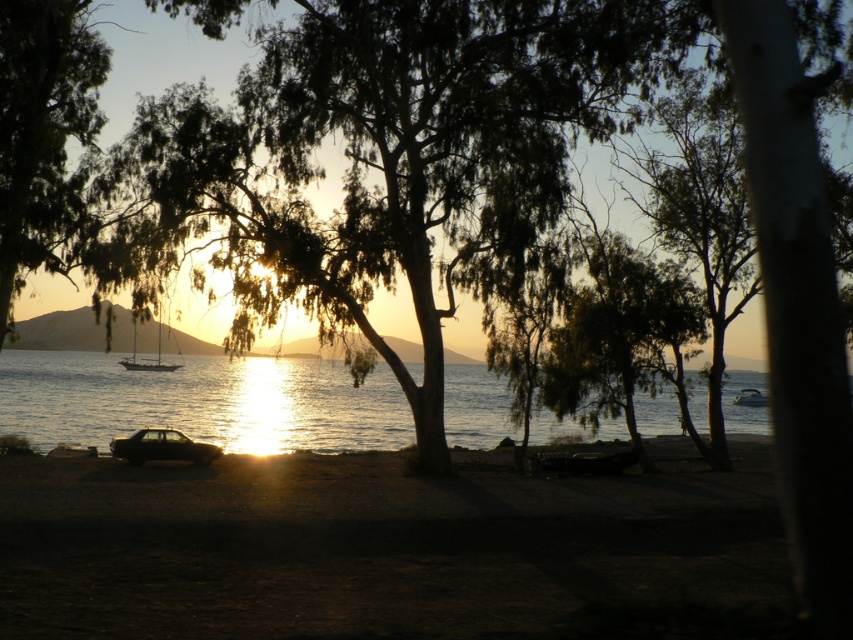
You are standing on the shore and want to take a photo of both the glistening water at center and the shiny metallic car at center. Which object should you focus on first if you want to ensure both are in the frame without adjusting your camera angle?

The glistening water at center has a greater height compared to the shiny metallic car at center, so you should focus on the glistening water at center first to ensure both are in the frame.

You are standing on the dark sand at lower center and want to walk to the shiny metallic car at center. Which direction should you move to reach the car?

Since the dark sand at lower center is bigger than the shiny metallic car at center, you should move towards the center of the image to reach the car.